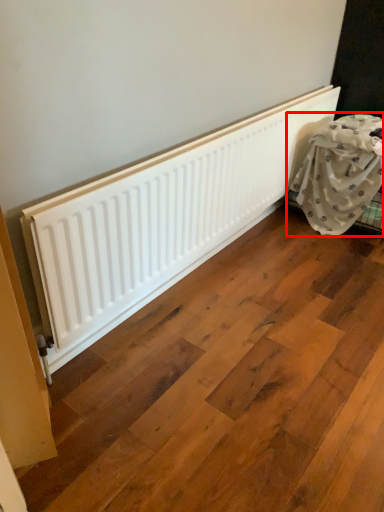
Question: From the image's perspective, where is furniture (annotated by the red box) located in relation to radiator in the image?

Choices:
 (A) above
 (B) below

Answer: (A)